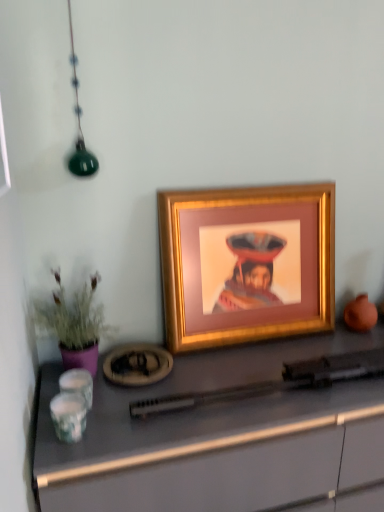
In order to face purple matte plant at left, should I rotate leftwards or rightwards?

To align with it, rotate left about 14.828°.

Identify the location of matte gray desk at center. This screenshot has width=384, height=512. (218, 435).

In order to click on purple matte plant at left in this screenshot , I will do `click(75, 323)`.

Which is nearer, (76, 292) or (331, 471)?

The point (331, 471) is more forward.

Looking at this image, is purple matte plant at left positioned before matte gray desk at center?

No.

From the image's perspective, is purple matte plant at left located above matte gray desk at center?

Indeed, from the image's perspective, purple matte plant at left is shown above matte gray desk at center.

Considering the sizes of purple matte plant at left and matte gray desk at center in the image, is purple matte plant at left bigger or smaller than matte gray desk at center?

purple matte plant at left is smaller than matte gray desk at center.

Can gold metallic picture frame at center be found inside matte gray desk at center?

No, matte gray desk at center does not contain gold metallic picture frame at center.

Is matte gray desk at center shorter than gold metallic picture frame at center?

Incorrect, the height of matte gray desk at center does not fall short of that of gold metallic picture frame at center.

From a real-world perspective, is matte gray desk at center located beneath gold metallic picture frame at center?

Yes, from a real-world perspective, matte gray desk at center is below gold metallic picture frame at center.

In terms of size, does matte gray desk at center appear bigger or smaller than gold metallic picture frame at center?

Considering their sizes, matte gray desk at center takes up more space than gold metallic picture frame at center.

Which of these two, gold metallic picture frame at center or matte gray desk at center, stands shorter?

Standing shorter between the two is gold metallic picture frame at center.

How distant is gold metallic picture frame at center from matte gray desk at center?

gold metallic picture frame at center is 10.96 inches away from matte gray desk at center.

Considering the sizes of objects gold metallic picture frame at center and matte gray desk at center in the image provided, who is thinner, gold metallic picture frame at center or matte gray desk at center?

gold metallic picture frame at center.

Is gold metallic picture frame at center not close to matte gray desk at center?

No, gold metallic picture frame at center is not far from matte gray desk at center.

Is point (293, 252) behind point (63, 293)?

Yes, point (293, 252) is farther from viewer.

Between gold metallic picture frame at center and purple matte plant at left, which one has less height?

Standing shorter between the two is purple matte plant at left.

From the image's perspective, which one is positioned lower, gold metallic picture frame at center or purple matte plant at left?

purple matte plant at left is shown below in the image.

Is purple matte plant at left at the back of matte gray desk at center?

No, purple matte plant at left is not at the back of matte gray desk at center.

Considering the positions of objects matte gray desk at center and purple matte plant at left in the image provided, who is more to the right, matte gray desk at center or purple matte plant at left?

matte gray desk at center.

From the image's perspective, who appears lower, matte gray desk at center or purple matte plant at left?

From the image's view, matte gray desk at center is below.

Can we say matte gray desk at center lies outside purple matte plant at left?

matte gray desk at center lies outside purple matte plant at left's area.

Which of these two, purple matte plant at left or gold metallic picture frame at center, is smaller?

With smaller size is purple matte plant at left.

Is purple matte plant at left looking in the opposite direction of gold metallic picture frame at center?

No, gold metallic picture frame at center is not at the back of purple matte plant at left.

I want to click on picture frame on the right of the purple matte plant at left, so click(246, 263).

Does point (66, 357) lie behind point (186, 323)?

No, (66, 357) is in front of (186, 323).

Where is `desk that is in front of the purple matte plant at left`? The width and height of the screenshot is (384, 512). desk that is in front of the purple matte plant at left is located at coordinates (218, 435).

This screenshot has height=512, width=384. I want to click on picture frame behind the matte gray desk at center, so click(246, 263).

When comparing their distances from purple matte plant at left, does gold metallic picture frame at center or matte gray desk at center seem further?

gold metallic picture frame at center.

When comparing their distances from matte gray desk at center, does gold metallic picture frame at center or purple matte plant at left seem further?

purple matte plant at left.

Which object lies nearer to the anchor point gold metallic picture frame at center, matte gray desk at center or purple matte plant at left?

Based on the image, matte gray desk at center appears to be nearer to gold metallic picture frame at center.

Which object lies nearer to the anchor point gold metallic picture frame at center, purple matte plant at left or matte gray desk at center?

matte gray desk at center.

Looking at the image, which one is located further to purple matte plant at left, matte gray desk at center or gold metallic picture frame at center?

The object further to purple matte plant at left is gold metallic picture frame at center.

From the picture: Considering their positions, is purple matte plant at left positioned closer to matte gray desk at center than gold metallic picture frame at center?

The object closer to matte gray desk at center is gold metallic picture frame at center.

Locate an element on the screen. houseplant that lies between gold metallic picture frame at center and matte gray desk at center from top to bottom is located at coordinates (75, 323).